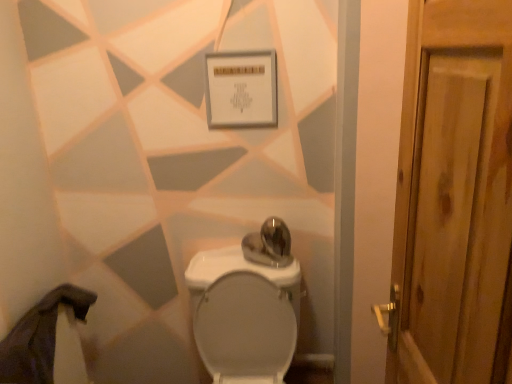
Describe the element at coordinates (241, 89) in the screenshot. I see `white matte sign at upper center` at that location.

Where is `white matte sign at upper center`? This screenshot has width=512, height=384. white matte sign at upper center is located at coordinates (241, 89).

Measure the distance between white glossy toilet at center and camera.

white glossy toilet at center and camera are 1.50 meters apart from each other.

Describe the element at coordinates (239, 269) in the screenshot. I see `white glossy toilet at center` at that location.

Where is `white glossy toilet at center`? Image resolution: width=512 pixels, height=384 pixels. white glossy toilet at center is located at coordinates (239, 269).

I want to click on white matte sign at upper center, so click(x=241, y=89).

Can you confirm if white glossy toilet at center is positioned to the left of white matte sign at upper center?

No.

Looking at this image, is white glossy toilet at center in front of or behind white matte sign at upper center in the image?

Visually, white glossy toilet at center is located in front of white matte sign at upper center.

Which is less distant, [293,286] or [215,75]?

Point [293,286] is farther from the camera than point [215,75].

From the image's perspective, which object appears higher, white glossy toilet at center or white matte sign at upper center?

white matte sign at upper center is shown above in the image.

From a real-world perspective, is white glossy toilet at center positioned under white matte sign at upper center based on gravity?

Correct, in the physical world, white glossy toilet at center is lower than white matte sign at upper center.

In terms of width, does white glossy toilet at center look wider or thinner when compared to white matte sign at upper center?

Clearly, white glossy toilet at center has more width compared to white matte sign at upper center.

Considering the sizes of objects white glossy toilet at center and white matte sign at upper center in the image provided, who is taller, white glossy toilet at center or white matte sign at upper center?

white glossy toilet at center is taller.

Who is smaller, white glossy toilet at center or white matte sign at upper center?

Smaller between the two is white matte sign at upper center.

Would you say white matte sign at upper center is part of white glossy toilet at center's contents?

Actually, white matte sign at upper center is outside white glossy toilet at center.

Is white glossy toilet at center positioned far away from white matte sign at upper center?

No, white glossy toilet at center is not far away from white matte sign at upper center.

Could you tell me if white glossy toilet at center is turned towards white matte sign at upper center?

No.

How many degrees apart are the facing directions of white glossy toilet at center and white matte sign at upper center?

They differ by 0.232 degrees in their facing directions.

How much distance is there between white glossy toilet at center and white matte sign at upper center?

22.75 inches.

The image size is (512, 384). I want to click on square above the white glossy toilet at center (from a real-world perspective), so click(x=241, y=89).

Between white matte sign at upper center and white glossy toilet at center, which one appears on the right side from the viewer's perspective?

white glossy toilet at center.

Who is more distant, white matte sign at upper center or white glossy toilet at center?

white matte sign at upper center is further from the camera.

Is point (246, 120) behind point (263, 269)?

No, it is in front of (263, 269).

From the image's perspective, does white matte sign at upper center appear lower than white glossy toilet at center?

Actually, white matte sign at upper center appears above white glossy toilet at center in the image.

From a real-world perspective, is white matte sign at upper center located higher than white glossy toilet at center?

Yes, from a real-world perspective, white matte sign at upper center is on top of white glossy toilet at center.

Considering the sizes of objects white matte sign at upper center and white glossy toilet at center in the image provided, who is thinner, white matte sign at upper center or white glossy toilet at center?

With smaller width is white matte sign at upper center.

From their relative heights in the image, would you say white matte sign at upper center is taller or shorter than white glossy toilet at center?

Considering their sizes, white matte sign at upper center has less height than white glossy toilet at center.

Can you confirm if white matte sign at upper center is smaller than white glossy toilet at center?

Yes, white matte sign at upper center is smaller than white glossy toilet at center.

Is white glossy toilet at center surrounded by white matte sign at upper center?

That's incorrect, white glossy toilet at center is not inside white matte sign at upper center.

Is white matte sign at upper center directly adjacent to white glossy toilet at center?

No, white matte sign at upper center is not making contact with white glossy toilet at center.

Is white matte sign at upper center facing towards white glossy toilet at center?

No, white matte sign at upper center is not turned towards white glossy toilet at center.

How different are the orientations of white matte sign at upper center and white glossy toilet at center in degrees?

white matte sign at upper center and white glossy toilet at center are facing 0.232 degrees away from each other.

Where is `square above the white glossy toilet at center (from the image's perspective)`? square above the white glossy toilet at center (from the image's perspective) is located at coordinates (241, 89).

What are the coordinates of `toilet to the right of white matte sign at upper center` in the screenshot? It's located at (239, 269).

Find the location of a particular element. square on the left of white glossy toilet at center is located at coordinates (241, 89).